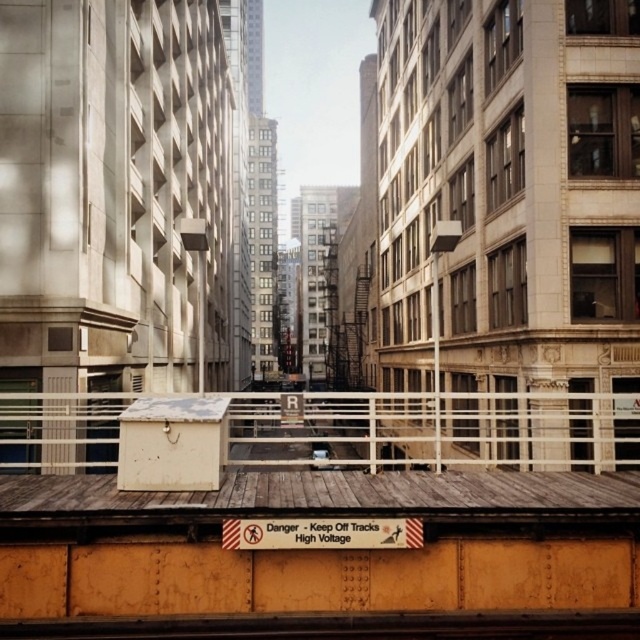
Which is more to the left, white metal rail at center or smooth steel train track at bottom center?

From the viewer's perspective, white metal rail at center appears more on the left side.

Can you confirm if white metal rail at center is positioned above smooth steel train track at bottom center?

No, white metal rail at center is not above smooth steel train track at bottom center.

Is point (17, 449) in front of point (497, 621)?

No.

The width and height of the screenshot is (640, 640). What are the coordinates of `white metal rail at center` in the screenshot? It's located at (349, 426).